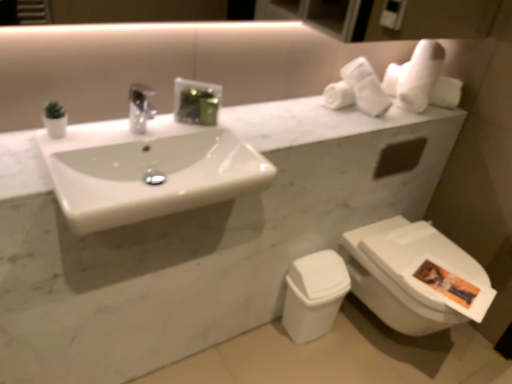
Question: From the image's perspective, is white glossy toilet at lower right below white soft towel at upper right?

Choices:
 (A) no
 (B) yes

Answer: (B)

Question: Does white glossy toilet at lower right appear on the left side of white soft towel at upper right?

Choices:
 (A) yes
 (B) no

Answer: (A)

Question: Can you confirm if white glossy toilet at lower right is taller than white soft towel at upper right?

Choices:
 (A) yes
 (B) no

Answer: (A)

Question: From a real-world perspective, is white glossy toilet at lower right located higher than white soft towel at upper right?

Choices:
 (A) no
 (B) yes

Answer: (A)

Question: Can we say white glossy toilet at lower right lies outside white soft towel at upper right?

Choices:
 (A) yes
 (B) no

Answer: (A)

Question: From the image's perspective, is white plastic toilet bowl at lower right above or below white glossy sink at center?

Choices:
 (A) above
 (B) below

Answer: (B)

Question: Which is correct: white plastic toilet bowl at lower right is inside white glossy sink at center, or outside of it?

Choices:
 (A) outside
 (B) inside

Answer: (A)

Question: In terms of size, does white plastic toilet bowl at lower right appear bigger or smaller than white glossy sink at center?

Choices:
 (A) small
 (B) big

Answer: (A)

Question: Looking at their shapes, would you say white plastic toilet bowl at lower right is wider or thinner than white glossy sink at center?

Choices:
 (A) wide
 (B) thin

Answer: (B)

Question: From the image's perspective, relative to white glossy toilet at lower right, is white soft towel at upper right above or below?

Choices:
 (A) below
 (B) above

Answer: (B)

Question: From a real-world perspective, relative to white glossy toilet at lower right, is white soft towel at upper right vertically above or below?

Choices:
 (A) above
 (B) below

Answer: (A)

Question: Is white soft towel at upper right inside or outside of white glossy toilet at lower right?

Choices:
 (A) outside
 (B) inside

Answer: (A)

Question: Is white soft towel at upper right taller or shorter than white glossy toilet at lower right?

Choices:
 (A) tall
 (B) short

Answer: (B)

Question: Considering the positions of white glossy toilet at lower right and white soft towel at upper right in the image, is white glossy toilet at lower right wider or thinner than white soft towel at upper right?

Choices:
 (A) thin
 (B) wide

Answer: (B)

Question: Looking at the image, does white glossy toilet at lower right seem bigger or smaller compared to white soft towel at upper right?

Choices:
 (A) big
 (B) small

Answer: (A)